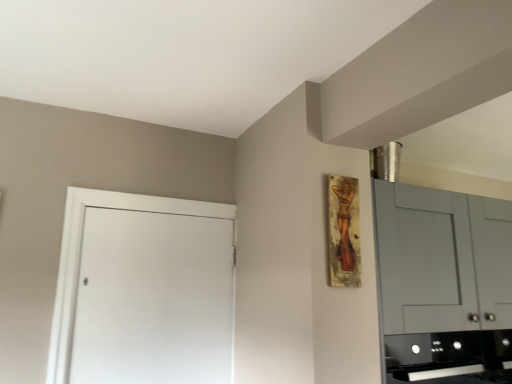
Question: From their relative heights in the image, would you say wooden painting at upper right is taller or shorter than black glossy oven at lower right?

Choices:
 (A) tall
 (B) short

Answer: (A)

Question: Considering the positions of point pos(346,243) and point pos(428,354), is point pos(346,243) closer or farther from the camera than point pos(428,354)?

Choices:
 (A) closer
 (B) farther

Answer: (A)

Question: Which is nearer to the white matte door at left?

Choices:
 (A) black glossy oven at lower right
 (B) wooden painting at upper right

Answer: (B)

Question: Estimate the real-world distances between objects in this image. Which object is farther from the wooden painting at upper right?

Choices:
 (A) black glossy oven at lower right
 (B) white matte door at left

Answer: (B)